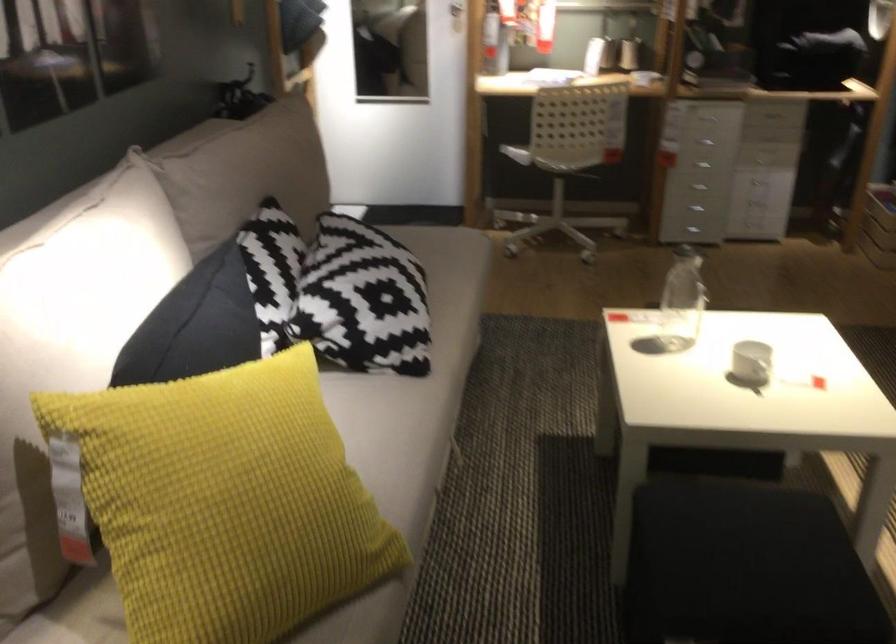
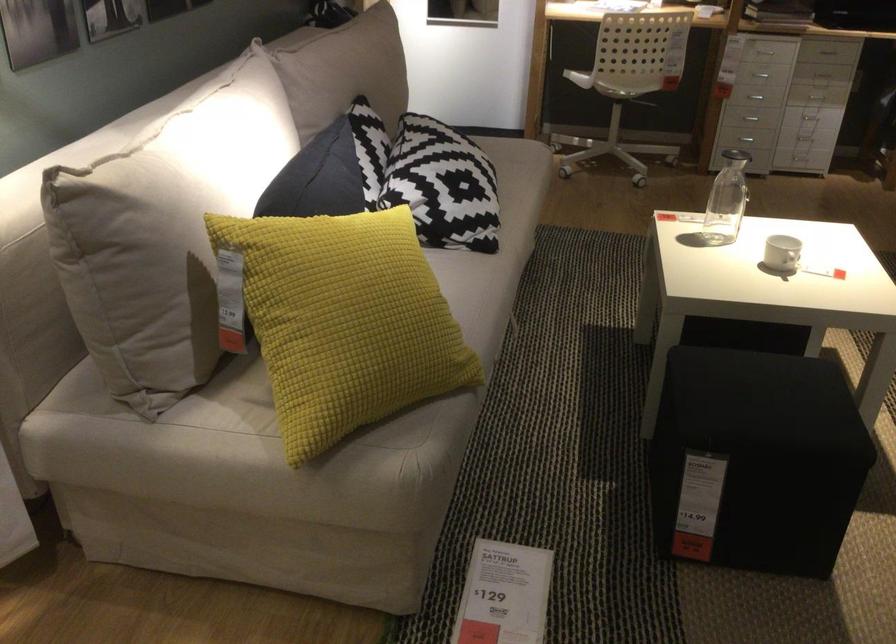
Locate, in the second image, the point that corresponds to (x=752, y=371) in the first image.

(781, 252)